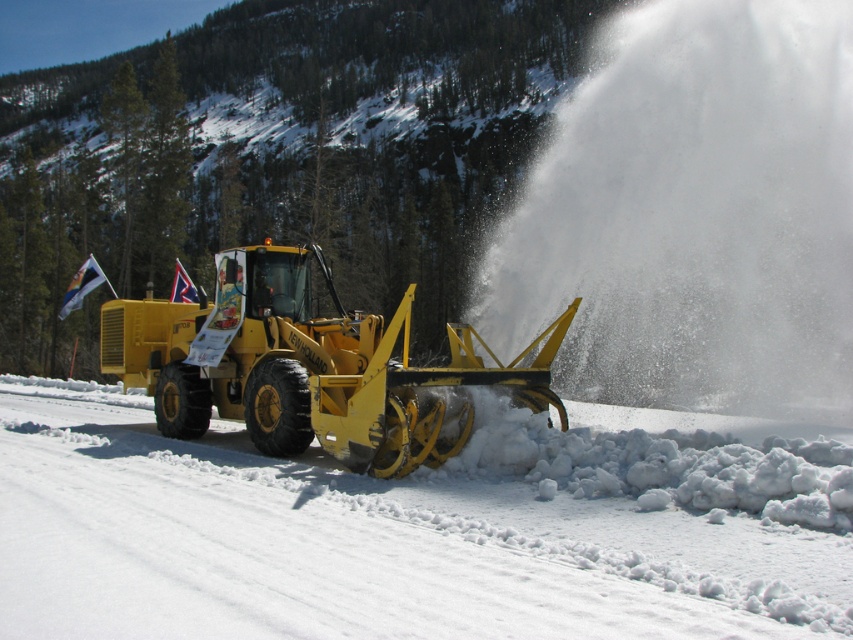
You are a traffic controller observing the snowy road clearing operation. You notice two snowplows, the yellow rubber snowplow at center and the yellow metallic snowplow at center. Which one is closer to you?

The yellow rubber snowplow at center is closer to you because it is in front of the yellow metallic snowplow at center.

You are standing at the point marked as point (251,534). You need to walk to the snowplow. Which direction should you go to reach it?

The snowplow is positioned on the right side of the road. Since you are at point (251,534), you should head towards the right side of the road to reach the snowplow.

You are a snowplow operator who needs to choose between the yellow rubber snowplow at center and the yellow metallic snowplow at center for clearing a narrow alleyway. Based on their widths, which one would be more suitable for the task?

The yellow metallic snowplow at center has a smaller width compared to the yellow rubber snowplow at center, making it more suitable for navigating narrow alleyways.